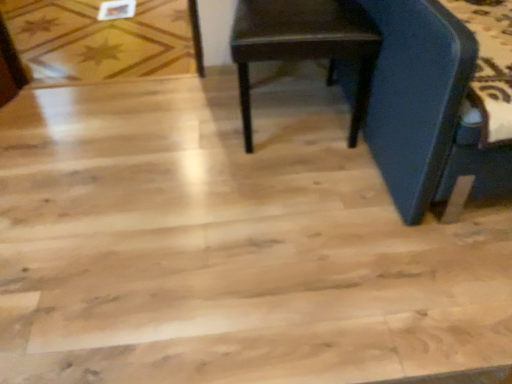
Question: Is wooden star-patterned floor at upper left wider or thinner than dark brown wood chair at center?

Choices:
 (A) thin
 (B) wide

Answer: (B)

Question: In terms of height, does wooden star-patterned floor at upper left look taller or shorter compared to dark brown wood chair at center?

Choices:
 (A) tall
 (B) short

Answer: (B)

Question: From a real-world perspective, is wooden star-patterned floor at upper left positioned above or below dark brown wood chair at center?

Choices:
 (A) below
 (B) above

Answer: (A)

Question: Is point (278, 3) positioned closer to the camera than point (162, 46)?

Choices:
 (A) closer
 (B) farther

Answer: (A)

Question: Considering the positions of dark brown wood chair at center and wooden star-patterned floor at upper left in the image, is dark brown wood chair at center wider or thinner than wooden star-patterned floor at upper left?

Choices:
 (A) thin
 (B) wide

Answer: (A)

Question: From the image's perspective, relative to wooden star-patterned floor at upper left, is dark brown wood chair at center above or below?

Choices:
 (A) above
 (B) below

Answer: (B)

Question: Relative to wooden star-patterned floor at upper left, is dark brown wood chair at center in front or behind?

Choices:
 (A) front
 (B) behind

Answer: (A)